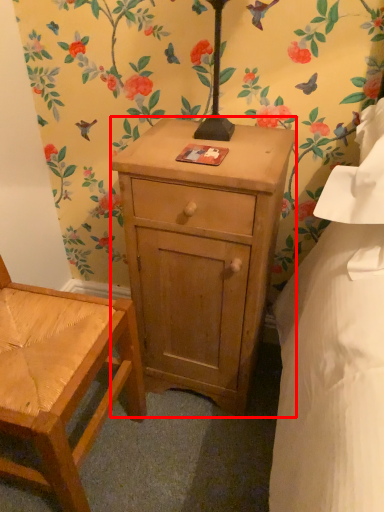
Question: From the image's perspective, where is nightstand (annotated by the red box) located in relation to chair in the image?

Choices:
 (A) above
 (B) below

Answer: (A)